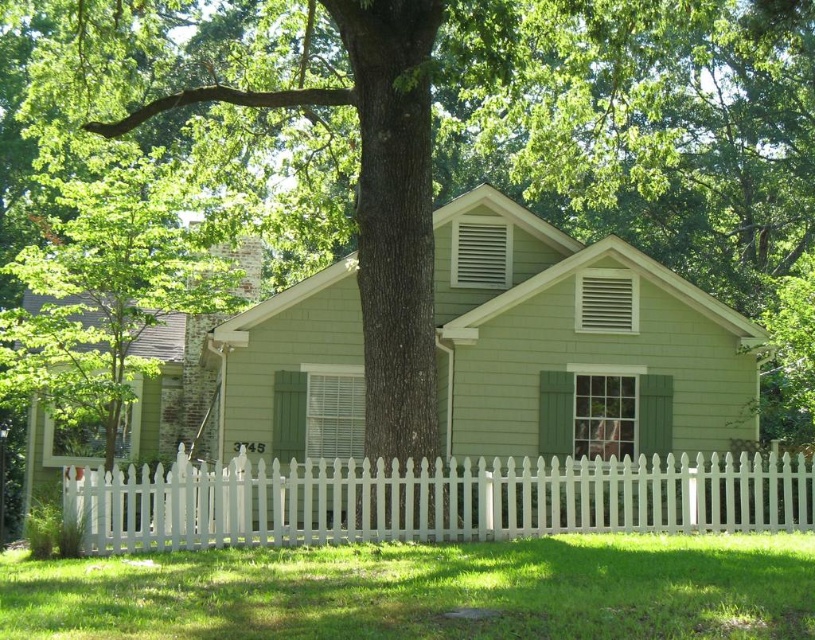
Can you confirm if green grass at lower center is smaller than green painted wood shutter at center?

No, green grass at lower center is not smaller than green painted wood shutter at center.

Does point (624, 582) come in front of point (316, 374)?

Yes, it is in front of point (316, 374).

Image resolution: width=815 pixels, height=640 pixels. What do you see at coordinates (426, 589) in the screenshot?
I see `green grass at lower center` at bounding box center [426, 589].

This screenshot has height=640, width=815. I want to click on green grass at lower center, so click(426, 589).

Who is taller, green painted wood shutter at center or white matte vent at upper center?

green painted wood shutter at center is taller.

Between green painted wood shutter at center and white matte vent at upper center, which one appears on the right side from the viewer's perspective?

Positioned to the right is white matte vent at upper center.

Locate an element on the screen. Image resolution: width=815 pixels, height=640 pixels. green painted wood shutter at center is located at coordinates (333, 416).

What do you see at coordinates (426, 589) in the screenshot? I see `green grass at lower center` at bounding box center [426, 589].

Is point (641, 632) behind point (143, 508)?

No, (641, 632) is closer to viewer.

You are a GUI agent. You are given a task and a screenshot of the screen. Output one action in this format:
    pyautogui.click(x=<x>, y=<y>)
    Task: Click on the green grass at lower center
    The image size is (815, 640).
    Given the screenshot: What is the action you would take?
    426,589